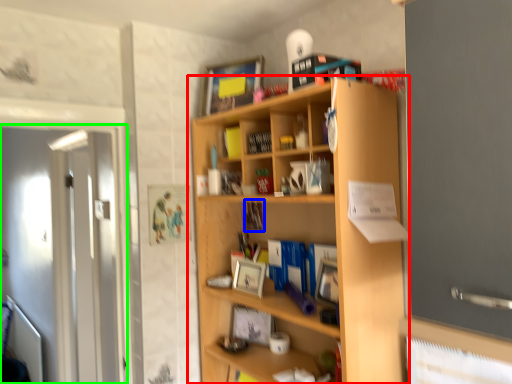
Question: Which object is positioned closest to shelf (highlighted by a red box)? Select from book (highlighted by a blue box) and screen door (highlighted by a green box).

Choices:
 (A) book
 (B) screen door

Answer: (A)